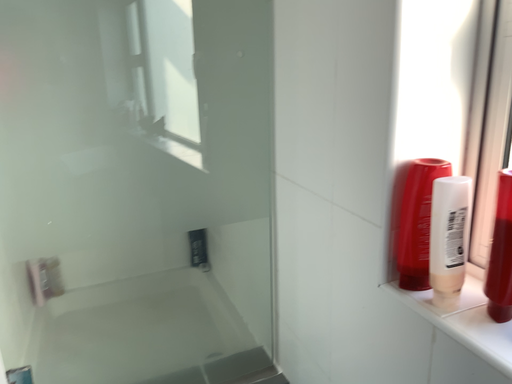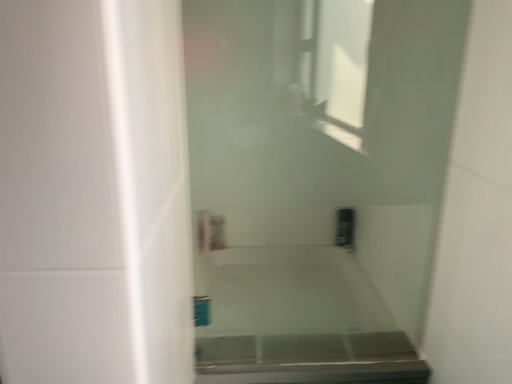
Question: Which way did the camera rotate in the video?

Choices:
 (A) rotated right
 (B) rotated left

Answer: (B)